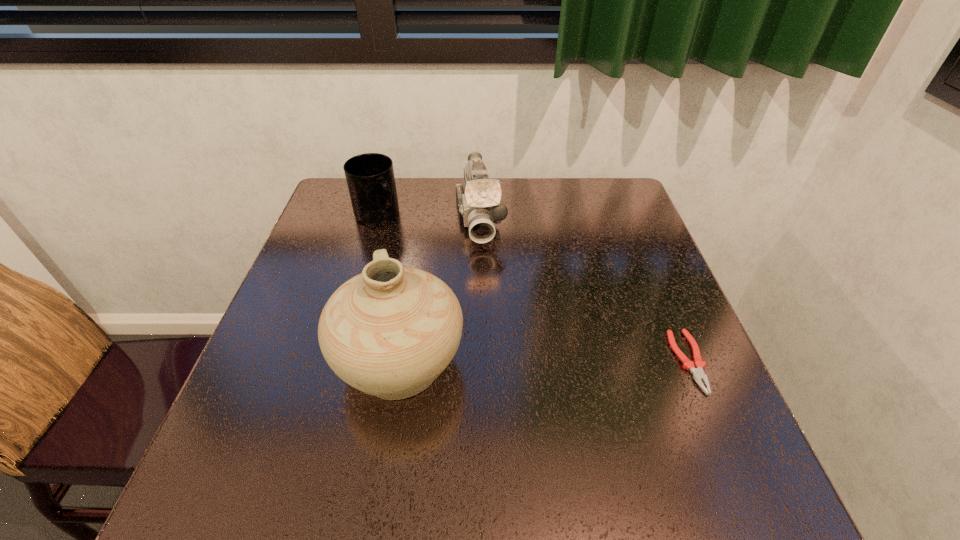
In order to click on vacant space located on the side of the mug with the handle in this screenshot , I will do `click(409, 251)`.

The image size is (960, 540). Identify the location of free space located 0.070m on the side of the mug with the handle. (399, 241).

The height and width of the screenshot is (540, 960). I want to click on free space located 0.300m on the side of the mug with the handle, so click(x=446, y=291).

Where is `camcorder located in the far edge section of the desktop`? camcorder located in the far edge section of the desktop is located at coordinates (479, 208).

Identify the location of mug positioned at the far edge. point(370,177).

Where is `object present at the near edge`? This screenshot has height=540, width=960. object present at the near edge is located at coordinates (390, 331).

The width and height of the screenshot is (960, 540). I want to click on pottery located at the left edge, so click(390, 331).

Identify the location of mug that is positioned at the left edge. (370, 177).

At what (x,y) coordinates should I click in order to perform the action: click on object that is at the right edge. Please return your answer as a coordinate pair (x, y). Looking at the image, I should click on (698, 373).

At what (x,y) coordinates should I click in order to perform the action: click on object at the far left corner. Please return your answer as a coordinate pair (x, y). This screenshot has height=540, width=960. Looking at the image, I should click on (370, 177).